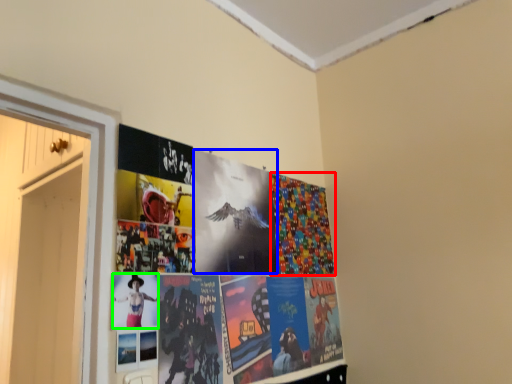
Question: Estimate the real-world distances between objects in this image. Which object is closer to flyer (highlighted by a red box), flyer (highlighted by a blue box) or person (highlighted by a green box)?

Choices:
 (A) flyer
 (B) person

Answer: (A)